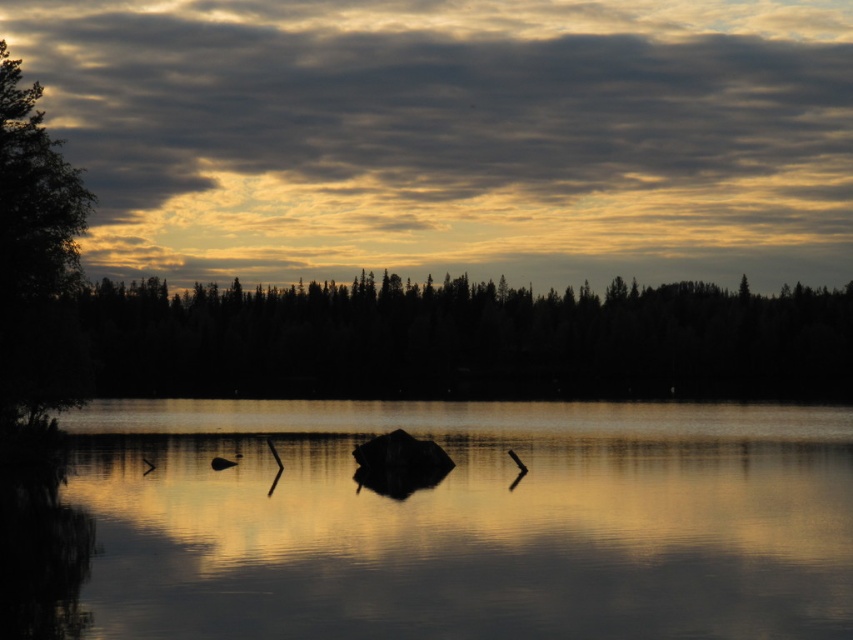
Who is positioned more to the right, cloudy sky at upper center or green leafy tree at left?

cloudy sky at upper center is more to the right.

Is cloudy sky at upper center below green leafy tree at left?

No, cloudy sky at upper center is not below green leafy tree at left.

Measure the distance between cloudy sky at upper center and camera.

The distance of cloudy sky at upper center from camera is 288.07 meters.

The height and width of the screenshot is (640, 853). I want to click on cloudy sky at upper center, so click(x=453, y=134).

Is smooth water at center wider than green leafy tree at left?

Correct, the width of smooth water at center exceeds that of green leafy tree at left.

Between smooth water at center and green leafy tree at left, which one is positioned higher?

Positioned higher is green leafy tree at left.

Is point (751, 474) in front of point (28, 355)?

Yes, point (751, 474) is in front of point (28, 355).

Where is `smooth water at center`? This screenshot has width=853, height=640. smooth water at center is located at coordinates (466, 522).

Does cloudy sky at upper center have a lesser height compared to silhouette/texture trees at center?

Incorrect, cloudy sky at upper center's height does not fall short of silhouette/texture trees at center's.

Find the location of a particular element. The width and height of the screenshot is (853, 640). cloudy sky at upper center is located at coordinates (453, 134).

You are a GUI agent. You are given a task and a screenshot of the screen. Output one action in this format:
    pyautogui.click(x=<x>, y=<y>)
    Task: Click on the cloudy sky at upper center
    The height and width of the screenshot is (640, 853).
    Given the screenshot: What is the action you would take?
    pyautogui.click(x=453, y=134)